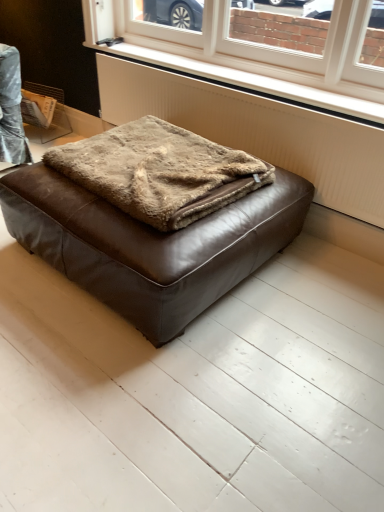
Question: Does brown leather ottoman at center have a greater width compared to white textured radiator at lower center?

Choices:
 (A) yes
 (B) no

Answer: (A)

Question: Can you confirm if brown leather ottoman at center is bigger than white textured radiator at lower center?

Choices:
 (A) yes
 (B) no

Answer: (A)

Question: Does brown leather ottoman at center have a smaller size compared to white textured radiator at lower center?

Choices:
 (A) yes
 (B) no

Answer: (B)

Question: Is brown leather ottoman at center oriented towards white textured radiator at lower center?

Choices:
 (A) no
 (B) yes

Answer: (A)

Question: Is brown leather ottoman at center positioned behind white textured radiator at lower center?

Choices:
 (A) no
 (B) yes

Answer: (A)

Question: From a real-world perspective, relative to brown fuzzy blanket at center, is white textured radiator at center vertically above or below?

Choices:
 (A) above
 (B) below

Answer: (B)

Question: Is white textured radiator at center situated inside brown fuzzy blanket at center or outside?

Choices:
 (A) outside
 (B) inside

Answer: (A)

Question: Looking at the image, does white textured radiator at center seem bigger or smaller compared to brown fuzzy blanket at center?

Choices:
 (A) small
 (B) big

Answer: (B)

Question: In the image, is white textured radiator at center on the left side or the right side of brown fuzzy blanket at center?

Choices:
 (A) right
 (B) left

Answer: (A)

Question: Relative to white plastic window at upper center, is brown leather ottoman at center in front or behind?

Choices:
 (A) front
 (B) behind

Answer: (A)

Question: Considering the positions of brown leather ottoman at center and white plastic window at upper center in the image, is brown leather ottoman at center bigger or smaller than white plastic window at upper center?

Choices:
 (A) small
 (B) big

Answer: (B)

Question: From a real-world perspective, is brown leather ottoman at center above or below white plastic window at upper center?

Choices:
 (A) above
 (B) below

Answer: (B)

Question: From the image's perspective, is brown leather ottoman at center positioned above or below white plastic window at upper center?

Choices:
 (A) below
 (B) above

Answer: (A)

Question: Considering the positions of point (259, 80) and point (246, 109), is point (259, 80) closer or farther from the camera than point (246, 109)?

Choices:
 (A) closer
 (B) farther

Answer: (A)

Question: From the image's perspective, is white textured radiator at lower center positioned above or below white textured radiator at center?

Choices:
 (A) below
 (B) above

Answer: (B)